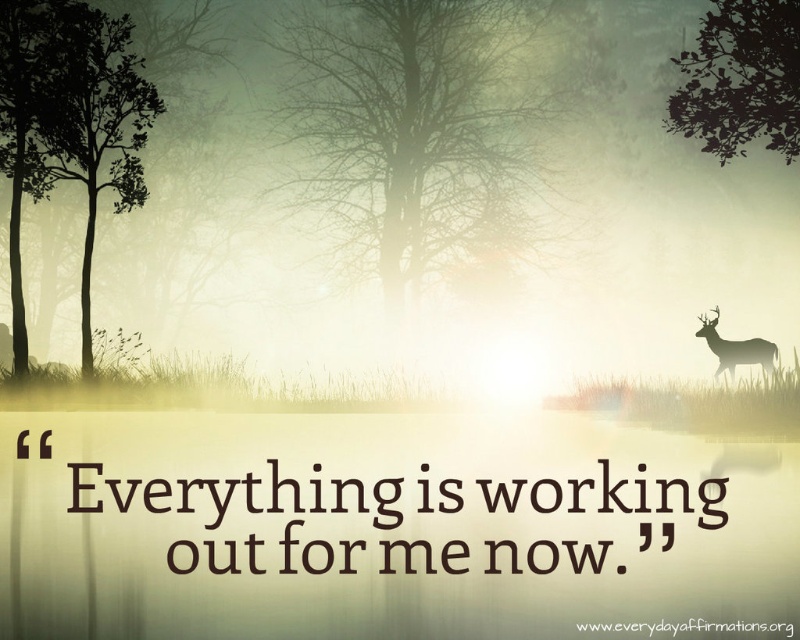
Does silvery branches at center have a lesser width compared to green leafy tree at upper right?

No.

Between point (420, 221) and point (732, 44), which one is positioned behind?

The point (420, 221) is behind.

Locate an element on the screen. silvery branches at center is located at coordinates (429, 115).

Does green leafy tree at upper right have a larger size compared to silhouette/transparent deer at right?

Indeed, green leafy tree at upper right has a larger size compared to silhouette/transparent deer at right.

Is green leafy tree at upper right smaller than silhouette/transparent deer at right?

No.

Which is in front, point (720, 68) or point (717, 348)?

Positioned in front is point (720, 68).

Find the location of a particular element. This screenshot has width=800, height=640. green leafy tree at upper right is located at coordinates (740, 80).

Does green leafy tree at left appear on the left side of silhouette/transparent deer at right?

Correct, you'll find green leafy tree at left to the left of silhouette/transparent deer at right.

Can you confirm if green leafy tree at left is smaller than silhouette/transparent deer at right?

Actually, green leafy tree at left might be larger than silhouette/transparent deer at right.

Who is more distant from viewer, [96,72] or [778,353]?

The point [96,72] is behind.

Find the location of a particular element. This screenshot has width=800, height=640. green leafy tree at left is located at coordinates [x=69, y=124].